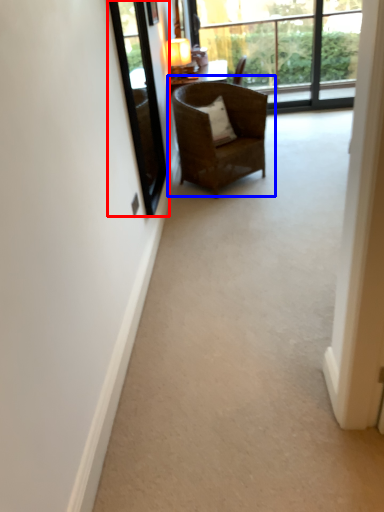
Question: Which object appears farthest to the camera in this image, window screen (highlighted by a red box) or chair (highlighted by a blue box)?

Choices:
 (A) window screen
 (B) chair

Answer: (B)